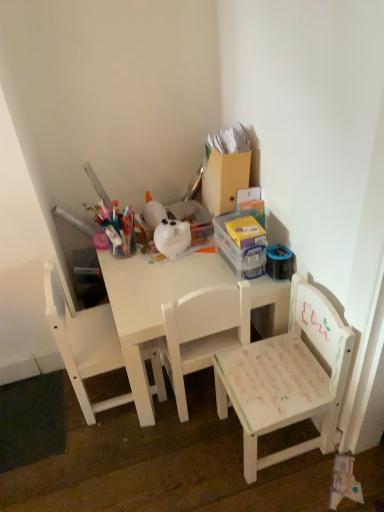
Question: Is white painted wood chair at lower right, the first chair from the right, located outside white matte table at center?

Choices:
 (A) no
 (B) yes

Answer: (B)

Question: Can you confirm if white painted wood chair at lower right, which appears as the 3th chair when viewed from the left, is bigger than white matte table at center?

Choices:
 (A) yes
 (B) no

Answer: (B)

Question: Can you confirm if white painted wood chair at lower right, the first chair from the right, is thinner than white matte table at center?

Choices:
 (A) no
 (B) yes

Answer: (B)

Question: From the image's perspective, is white painted wood chair at lower right, the first chair from the right, located beneath white matte table at center?

Choices:
 (A) yes
 (B) no

Answer: (A)

Question: Does white painted wood chair at lower right, which appears as the 3th chair when viewed from the left, have a lesser height compared to white matte table at center?

Choices:
 (A) no
 (B) yes

Answer: (A)

Question: Is white painted wood chair at lower right, which appears as the 3th chair when viewed from the left, with white matte table at center?

Choices:
 (A) no
 (B) yes

Answer: (A)

Question: Is white matte chair at center, the first chair from the left, oriented towards white matte table at center?

Choices:
 (A) no
 (B) yes

Answer: (B)

Question: From a real-world perspective, is white matte chair at center, which ranks as the third chair in right-to-left order, physically below white matte table at center?

Choices:
 (A) no
 (B) yes

Answer: (A)

Question: Is white matte chair at center, the first chair from the left, bigger than white matte table at center?

Choices:
 (A) no
 (B) yes

Answer: (A)

Question: Considering the relative sizes of white matte chair at center, which ranks as the third chair in right-to-left order, and white matte table at center in the image provided, is white matte chair at center, which ranks as the third chair in right-to-left order, shorter than white matte table at center?

Choices:
 (A) no
 (B) yes

Answer: (A)

Question: Does white matte chair at center, the first chair from the left, appear on the left side of white matte table at center?

Choices:
 (A) no
 (B) yes

Answer: (B)

Question: Is white matte chair at center, the first chair from the left, oriented away from white matte table at center?

Choices:
 (A) yes
 (B) no

Answer: (B)

Question: Does white painted wood chair at center, marked as the 2th chair in a right-to-left arrangement, have a larger size compared to white painted wood chair at lower right, the first chair from the right?

Choices:
 (A) yes
 (B) no

Answer: (B)